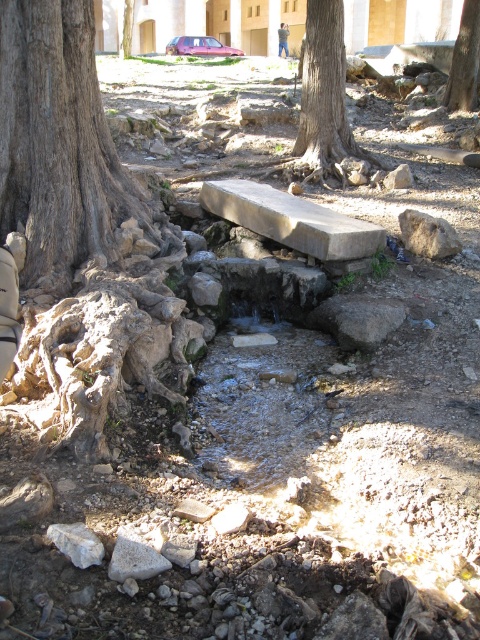
Does brown rough tree at center come in front of smooth stone bench at center?

No.

Which of these two, brown rough tree at center or smooth stone bench at center, stands shorter?

With less height is smooth stone bench at center.

What do you see at coordinates (325, 97) in the screenshot?
I see `brown rough tree at center` at bounding box center [325, 97].

Locate an element on the screen. This screenshot has width=480, height=640. brown rough tree at center is located at coordinates click(325, 97).

Is brown rough tree trunk at left smaller than brown rough tree at upper center?

No, brown rough tree trunk at left is not smaller than brown rough tree at upper center.

Which is below, brown rough tree trunk at left or brown rough tree at upper center?

brown rough tree trunk at left

You are a GUI agent. You are given a task and a screenshot of the screen. Output one action in this format:
    pyautogui.click(x=<x>, y=<y>)
    Task: Click on the brown rough tree trunk at left
    The image size is (480, 640).
    Given the screenshot: What is the action you would take?
    pyautogui.click(x=82, y=232)

Between brown rough tree trunk at left and white rough rock at lower left, which one has more height?

brown rough tree trunk at left

Measure the distance between point (110,348) and camera.

The distance of point (110,348) from camera is 3.67 meters.

Which is behind, point (79, 282) or point (78, 532)?

Point (79, 282)

Locate an element on the screen. brown rough tree trunk at left is located at coordinates (82, 232).